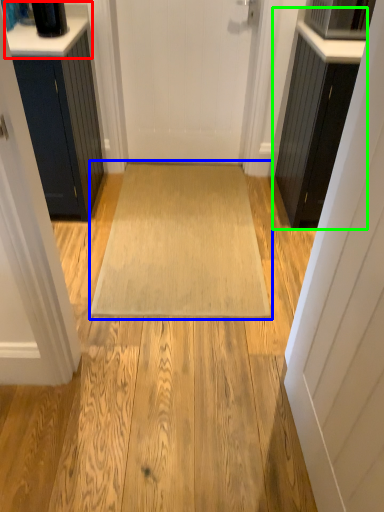
Question: Based on their relative distances, which object is farther from counter top (highlighted by a red box)? Choose from doormat (highlighted by a blue box) and cabinetry (highlighted by a green box).

Choices:
 (A) doormat
 (B) cabinetry

Answer: (B)